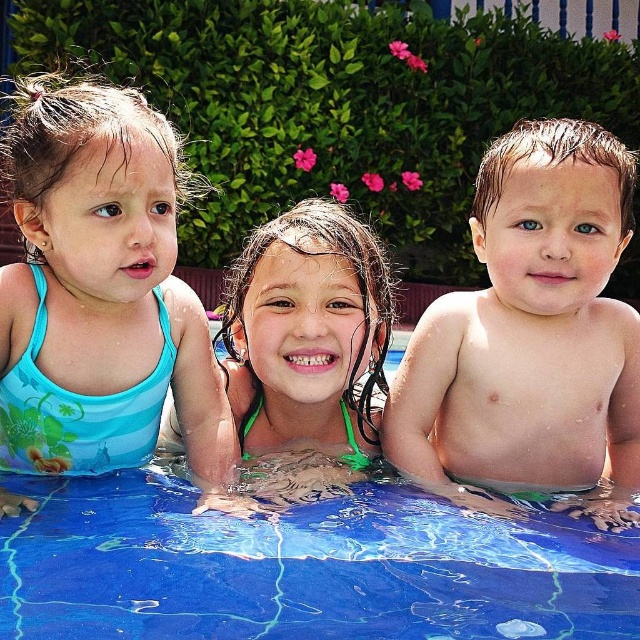
Looking at this image, you are a photographer standing at the edge of the pool. You want to take a photo of the smooth skin baby at right and the green fabric swimsuit at center. Which object will appear larger in the photo?

The smooth skin baby at right will appear larger in the photo because it is closer to the viewer than the green fabric swimsuit at center.

Based on the scene description, which object is shorter between the blue printed swimsuit at left and the smooth skin baby at right?

The blue printed swimsuit at left is shorter than the smooth skin baby at right according to the description.